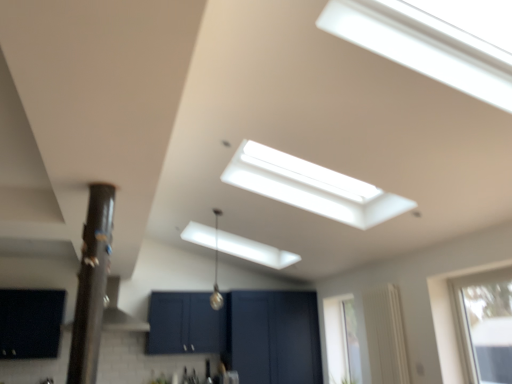
Question: Should I look upward or downward to see black glossy pole at left?

Choices:
 (A) down
 (B) up

Answer: (A)

Question: Is transparent glass window at upper right, marked as the 3th window in a left-to-right arrangement, to the left of matte black cabinet at lower left, the 3th window viewed from the right, from the viewer's perspective?

Choices:
 (A) no
 (B) yes

Answer: (A)

Question: Can you confirm if transparent glass window at upper right, acting as the 3th window starting from the back, is taller than matte black cabinet at lower left, the second window viewed from the back?

Choices:
 (A) no
 (B) yes

Answer: (B)

Question: From a real-world perspective, does transparent glass window at upper right, placed as the 1th window when sorted from front to back, sit lower than matte black cabinet at lower left, which is counted as the 1th window, starting from the left?

Choices:
 (A) yes
 (B) no

Answer: (A)

Question: Is transparent glass window at upper right, positioned as the 1th window in right-to-left order, smaller than matte black cabinet at lower left, the second window viewed from the back?

Choices:
 (A) yes
 (B) no

Answer: (A)

Question: Is matte black cabinet at lower left, the second window viewed from the back, at the back of transparent glass window at upper right, positioned as the 1th window in right-to-left order?

Choices:
 (A) yes
 (B) no

Answer: (B)

Question: Can you confirm if transparent glass window at upper right, marked as the 3th window in a left-to-right arrangement, is bigger than matte black cabinet at lower left, the 2th window from the front?

Choices:
 (A) no
 (B) yes

Answer: (A)

Question: Can you confirm if clear glass window at right, which ranks as the first window in back-to-front order, is shorter than transparent glass window at upper right, marked as the 3th window in a left-to-right arrangement?

Choices:
 (A) no
 (B) yes

Answer: (A)

Question: Is clear glass window at right, which is counted as the third window, starting from the front, not inside transparent glass window at upper right, positioned as the 1th window in right-to-left order?

Choices:
 (A) yes
 (B) no

Answer: (A)

Question: Considering the relative sizes of clear glass window at right, marked as the second window in a right-to-left arrangement, and transparent glass window at upper right, placed as the 1th window when sorted from front to back, in the image provided, is clear glass window at right, marked as the second window in a right-to-left arrangement, smaller than transparent glass window at upper right, placed as the 1th window when sorted from front to back,?

Choices:
 (A) no
 (B) yes

Answer: (B)

Question: From a real-world perspective, is clear glass window at right, which is counted as the third window, starting from the front, below transparent glass window at upper right, positioned as the 1th window in right-to-left order?

Choices:
 (A) yes
 (B) no

Answer: (A)

Question: From a real-world perspective, is clear glass window at right, marked as the second window in a right-to-left arrangement, on transparent glass window at upper right, placed as the 1th window when sorted from front to back?

Choices:
 (A) yes
 (B) no

Answer: (B)

Question: Is clear glass window at right, which is counted as the third window, starting from the front, positioned with its back to transparent glass window at upper right, acting as the 3th window starting from the back?

Choices:
 (A) yes
 (B) no

Answer: (B)

Question: From a real-world perspective, is transparent glass window at upper right, acting as the 3th window starting from the back, beneath clear glass window at right, which ranks as the first window in back-to-front order?

Choices:
 (A) yes
 (B) no

Answer: (B)